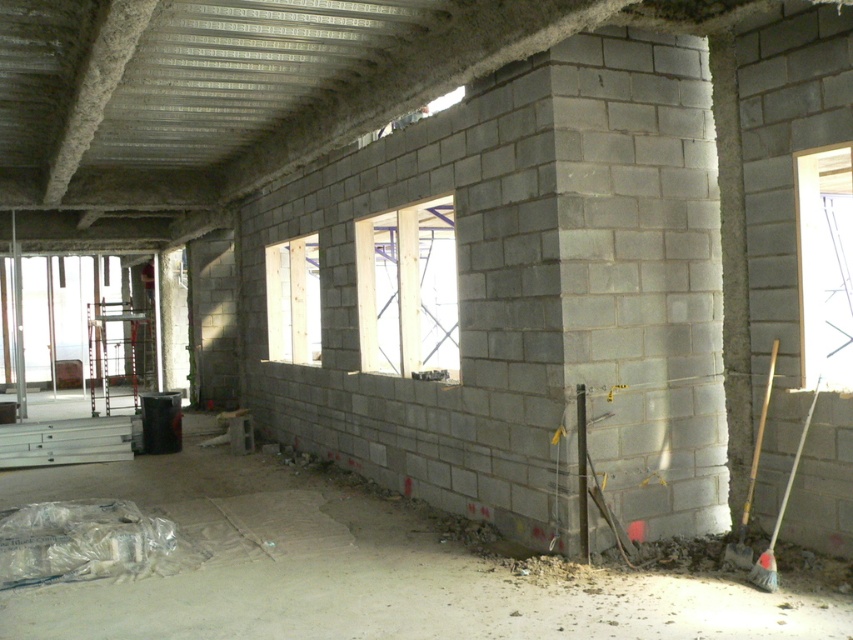
You are a construction worker standing at the center of the room. You need to check the weather outside through the transparent glass window at right. Where should you move to in order to see it clearly?

The transparent glass window at right is located at point (825, 264), so you should move towards the right side of the room to see it clearly.

You are a construction worker standing at the entrance of the construction site. You need to determine which object is taller between the gray concrete basement at lower center and the light wood window at center. Based on the scene description, which one is taller?

The light wood window at center is taller than the gray concrete basement at lower center.

You are a construction worker standing in the middle of the room. You need to clean debris from the floor near the transparent glass window at right and the wooden handle broom at lower right. Which object should you move first to access the cleaning area?

You should move the wooden handle broom at lower right first because the transparent glass window at right is positioned over it, meaning the broom is underneath the window and blocking access to the cleaning area near the window.